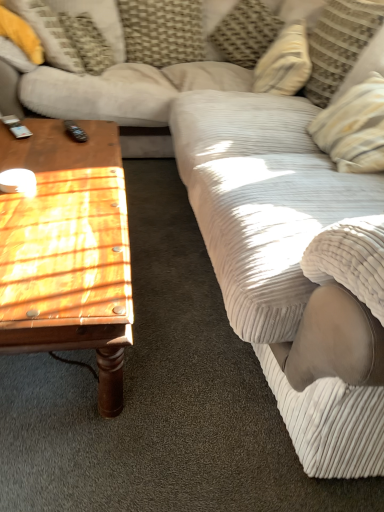
This screenshot has width=384, height=512. I want to click on vacant space to the right of black plastic remote at left, so click(x=100, y=135).